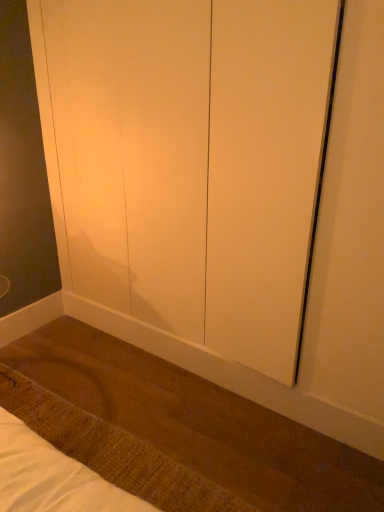
Question: Is matte white screen door at center taller or shorter than brown woven mat at lower left?

Choices:
 (A) tall
 (B) short

Answer: (A)

Question: Is matte white screen door at center in front of or behind brown woven mat at lower left in the image?

Choices:
 (A) behind
 (B) front

Answer: (B)

Question: Is matte white screen door at center to the left or to the right of brown woven mat at lower left in the image?

Choices:
 (A) left
 (B) right

Answer: (B)

Question: From a real-world perspective, relative to matte white screen door at center, is brown woven mat at lower left vertically above or below?

Choices:
 (A) above
 (B) below

Answer: (B)

Question: In the image, is brown woven mat at lower left positioned in front of or behind matte white screen door at center?

Choices:
 (A) behind
 (B) front

Answer: (A)

Question: Considering the positions of point (145, 474) and point (92, 266), is point (145, 474) closer or farther from the camera than point (92, 266)?

Choices:
 (A) closer
 (B) farther

Answer: (A)

Question: Is brown woven mat at lower left wider or thinner than matte white screen door at center?

Choices:
 (A) wide
 (B) thin

Answer: (A)